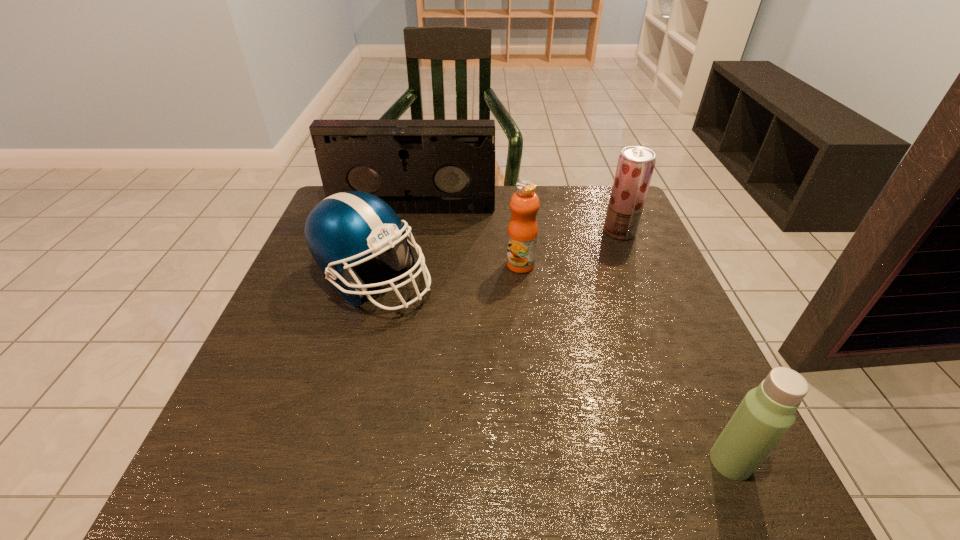
Find the location of a particular element. free spot between the farther fruit juice and the third object from left to right is located at coordinates (570, 248).

Identify the location of empty location between the farther fruit juice and the third object from right to left. The width and height of the screenshot is (960, 540). (570, 248).

The height and width of the screenshot is (540, 960). What are the coordinates of `blank region between the football helmet and the thermos bottle` in the screenshot? It's located at (552, 372).

Where is `vacant area that lies between the football helmet and the left fruit juice`? Image resolution: width=960 pixels, height=540 pixels. vacant area that lies between the football helmet and the left fruit juice is located at coordinates (447, 273).

Where is `free space between the nearest object and the football helmet`? The image size is (960, 540). free space between the nearest object and the football helmet is located at coordinates (552, 372).

Identify which object is the nearest to the thermos bottle. Please provide its 2D coordinates. Your answer should be formatted as a tuple, i.e. [(x, y)], where the tuple contains the x and y coordinates of a point satisfying the conditions above.

[(522, 235)]

Identify which object is the third nearest to the third object from left to right. Please provide its 2D coordinates. Your answer should be formatted as a tuple, i.e. [(x, y)], where the tuple contains the x and y coordinates of a point satisfying the conditions above.

[(635, 166)]

At what (x,y) coordinates should I click in order to perform the action: click on vacant space that satisfies the following two spatial constraints: 1. on the front side of the farthest object; 2. at the front of the football helmet with the faceguard. Please return your answer as a coordinate pair (x, y). This screenshot has width=960, height=540. Looking at the image, I should click on (397, 281).

Locate an element on the screen. The width and height of the screenshot is (960, 540). free point that satisfies the following two spatial constraints: 1. on the front side of the nearer fruit juice; 2. at the front of the football helmet with the faceguard is located at coordinates (522, 281).

Locate an element on the screen. This screenshot has height=540, width=960. free location that satisfies the following two spatial constraints: 1. on the front side of the third object from right to left; 2. at the front of the football helmet with the faceguard is located at coordinates (522, 281).